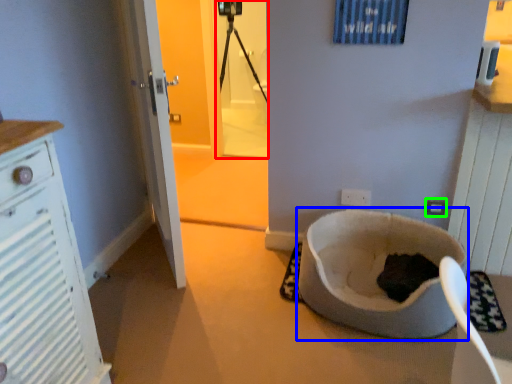
Question: Estimate the real-world distances between objects in this image. Which object is closer to screen door (highlighted by a red box), toilet bowl (highlighted by a blue box) or electric outlet (highlighted by a green box)?

Choices:
 (A) toilet bowl
 (B) electric outlet

Answer: (A)